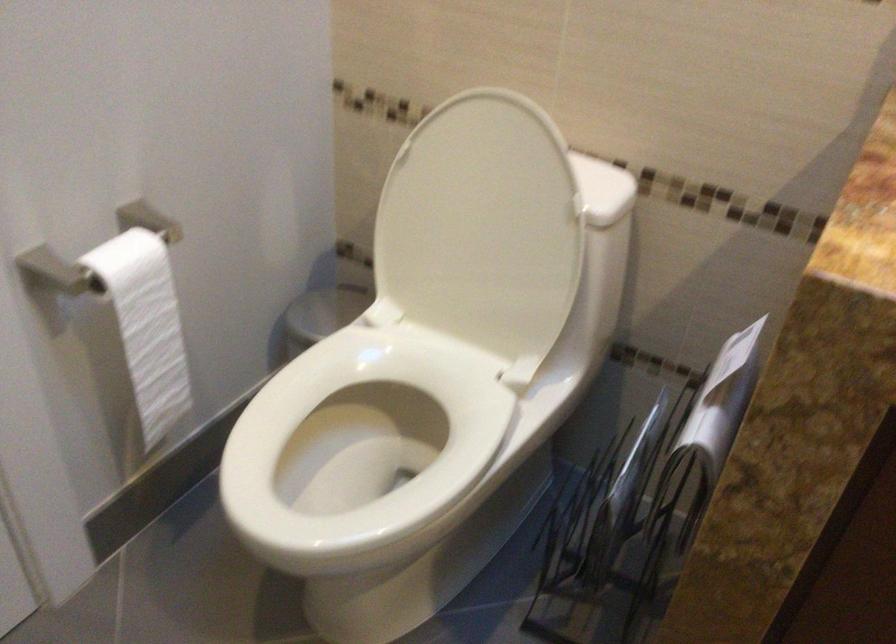
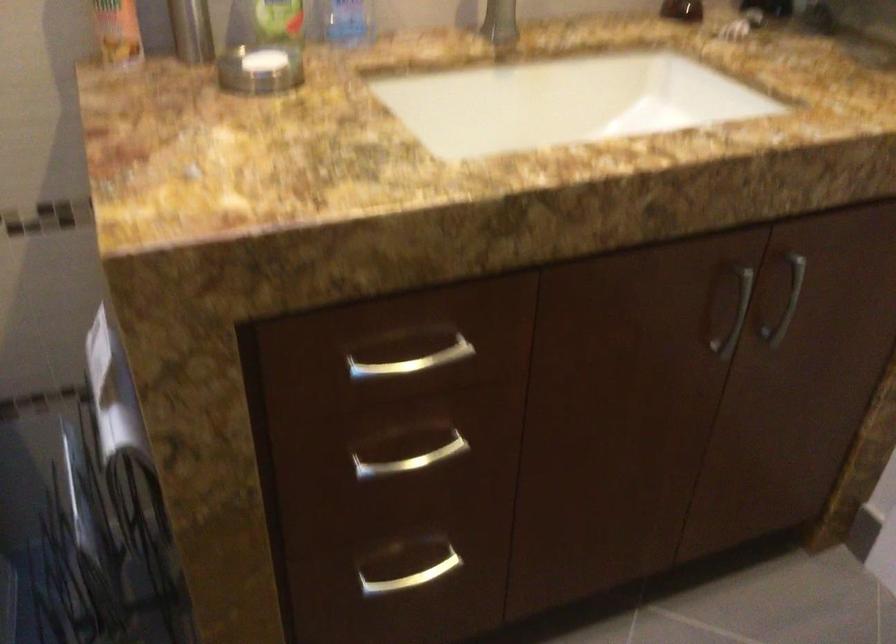
Question: The camera is either moving clockwise (left) or counter-clockwise (right) around the object. The first image is from the beginning of the video and the second image is from the end. Is the camera moving left or right when shooting the video?

Choices:
 (A) Left
 (B) Right

Answer: (A)